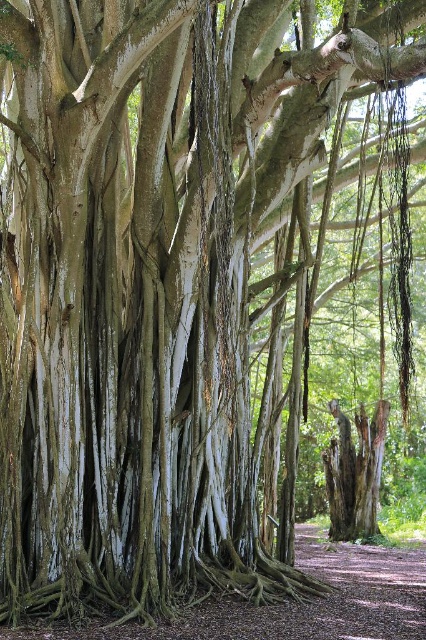
Question: Does brown dirt path at lower center have a lesser width compared to smooth gray bark at center?

Choices:
 (A) yes
 (B) no

Answer: (B)

Question: Which object is farther from the camera taking this photo?

Choices:
 (A) brown dirt path at lower center
 (B) smooth gray bark at center

Answer: (B)

Question: Does brown dirt path at lower center come in front of smooth gray bark at center?

Choices:
 (A) yes
 (B) no

Answer: (A)

Question: Which object is farther from the camera taking this photo?

Choices:
 (A) brown dirt path at lower center
 (B) smooth gray bark at center

Answer: (B)

Question: Can you confirm if brown dirt path at lower center is positioned to the right of smooth gray bark at center?

Choices:
 (A) yes
 (B) no

Answer: (B)